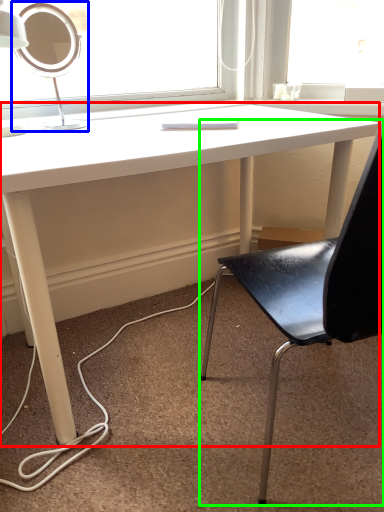
Question: Which is nearer to the desk (highlighted by a red box)? table lamp (highlighted by a blue box) or chair (highlighted by a green box).

Choices:
 (A) table lamp
 (B) chair

Answer: (A)